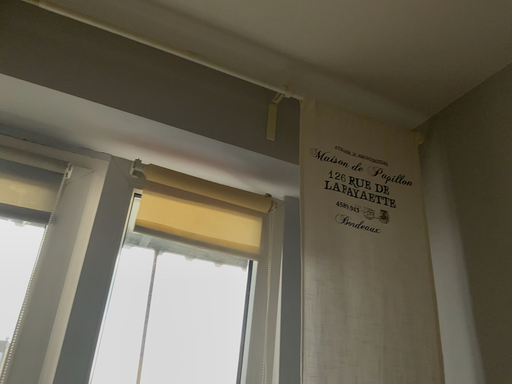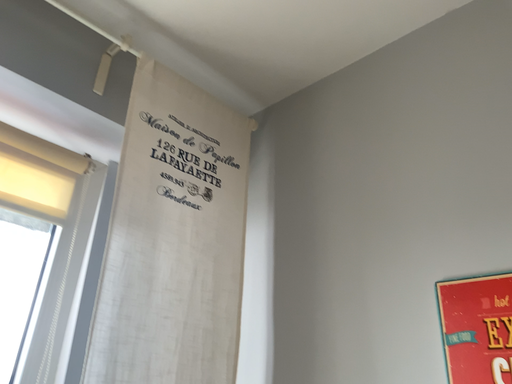
Question: Which way did the camera rotate in the video?

Choices:
 (A) rotated right
 (B) rotated left

Answer: (A)